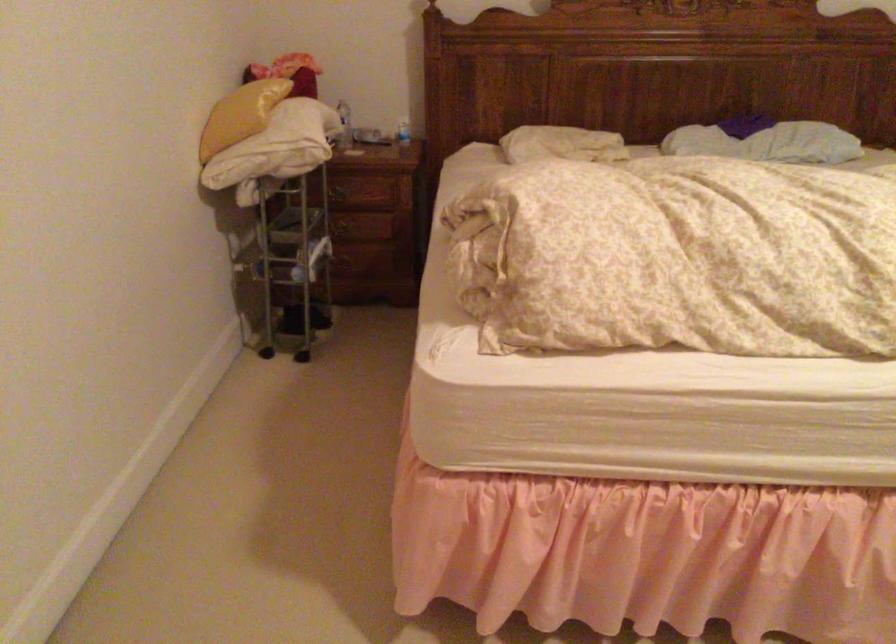
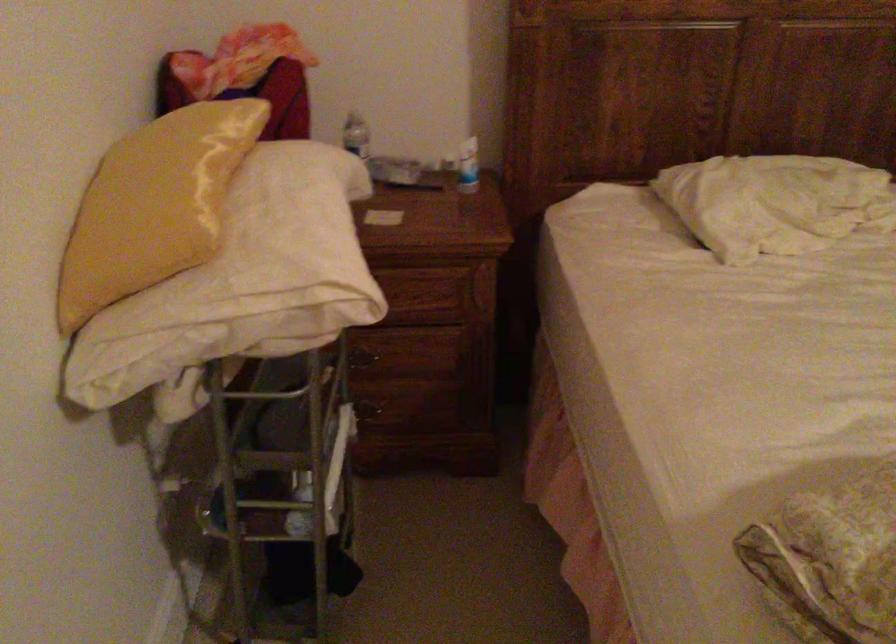
The point at [409,126] is marked in the first image. Where is the corresponding point in the second image?

(468, 166)